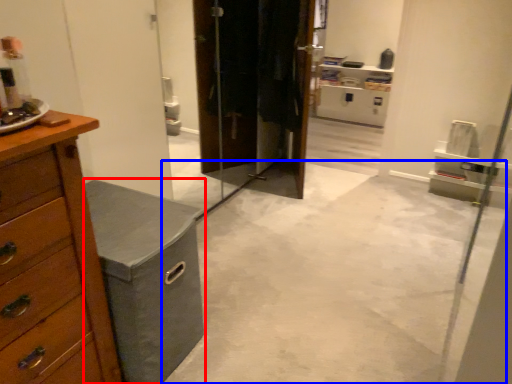
Question: Which object appears closest to the camera in this image, vanity (highlighted by a red box) or concrete (highlighted by a blue box)?

Choices:
 (A) vanity
 (B) concrete

Answer: (B)